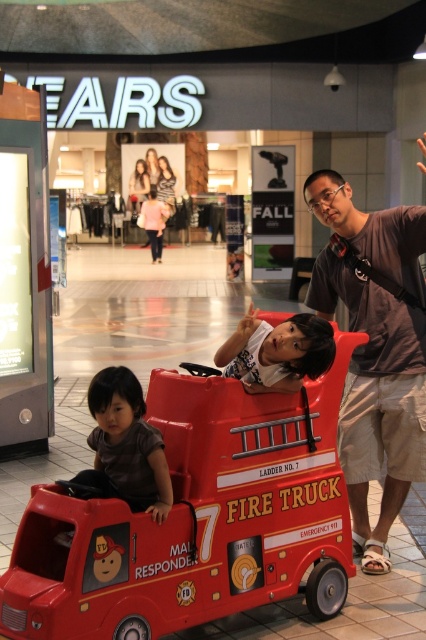
You are a parent trying to find your child who is playing with a shiny plastic fire truck at center. Your child is wearing a matte brown shirt at lower left. Based on the scene, can you tell if your child is near the fire truck?

The shiny plastic fire truck at center is in front of matte brown shirt at lower left, so the child wearing the matte brown shirt at lower left is behind the fire truck and not near it.

You are a parent trying to take a photo of your child playing with the shiny plastic fire truck at center and the matte gray shirt at center. Which object should you focus on first to ensure both are in focus?

You should focus on the shiny plastic fire truck at center first because it is closer to the viewer than the matte gray shirt at center, so focusing on it will help ensure both objects are in focus.

You are a parent trying to decide if your child can sit between the shiny plastic fire truck at center and the matte brown shirt at lower left. Can they fit comfortably?

The shiny plastic fire truck at center might be wider than matte brown shirt at lower left, so there may not be enough space for the child to sit comfortably between them.